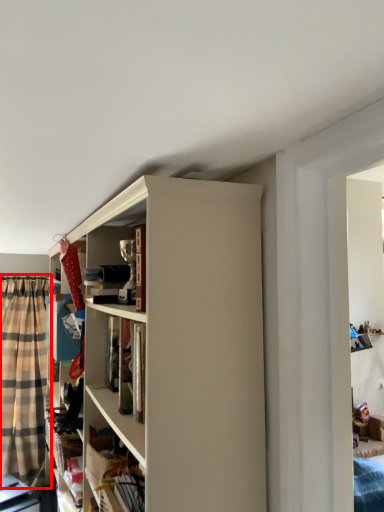
Question: In this image, where is curtain (annotated by the red box) located relative to cabinet?

Choices:
 (A) right
 (B) left

Answer: (B)